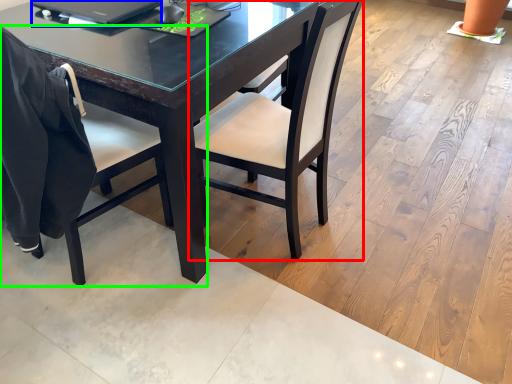
Question: Which object is the farthest from chair (highlighted by a red box)? Choose among these: laptop (highlighted by a blue box) or chair (highlighted by a green box).

Choices:
 (A) laptop
 (B) chair

Answer: (A)